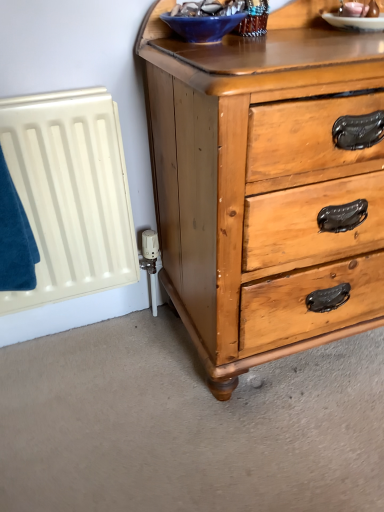
What do you see at coordinates (203, 26) in the screenshot? I see `blue glossy bowl at upper center` at bounding box center [203, 26].

Identify the location of blue glossy bowl at upper center. The height and width of the screenshot is (512, 384). (203, 26).

Where is `blue glossy bowl at upper center`? The width and height of the screenshot is (384, 512). blue glossy bowl at upper center is located at coordinates (203, 26).